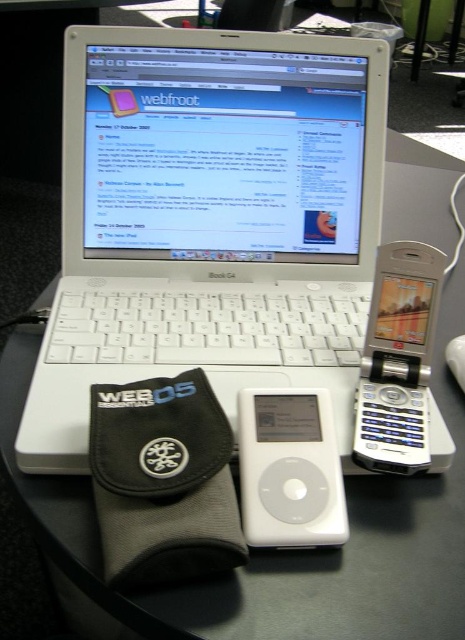
Is white matte ipod at center bigger than white plastic mouse at lower right?

Yes.

Is the position of white matte ipod at center more distant than that of white plastic mouse at lower right?

No.

Which is behind, point (268, 468) or point (453, 342)?

The point (453, 342) is more distant.

This screenshot has height=640, width=465. In order to click on white matte ipod at center in this screenshot , I will do `click(290, 468)`.

Is point (422, 401) closer to viewer compared to point (283, 483)?

No, it is behind (283, 483).

Between silver metallic flip phone at right and white matte ipod at center, which one appears on the right side from the viewer's perspective?

silver metallic flip phone at right

Which is behind, point (379, 276) or point (326, 540)?

The point (379, 276) is more distant.

Where is `silver metallic flip phone at right`? The image size is (465, 640). silver metallic flip phone at right is located at coordinates (398, 360).

Which is below, white plastic laptop at center or white plastic mouse at lower right?

Positioned lower is white plastic mouse at lower right.

Can you confirm if white plastic laptop at center is shorter than white plastic mouse at lower right?

No, white plastic laptop at center is not shorter than white plastic mouse at lower right.

Which is in front, point (203, 323) or point (458, 371)?

Point (458, 371) is in front.

Find the location of a particular element. white plastic laptop at center is located at coordinates (210, 220).